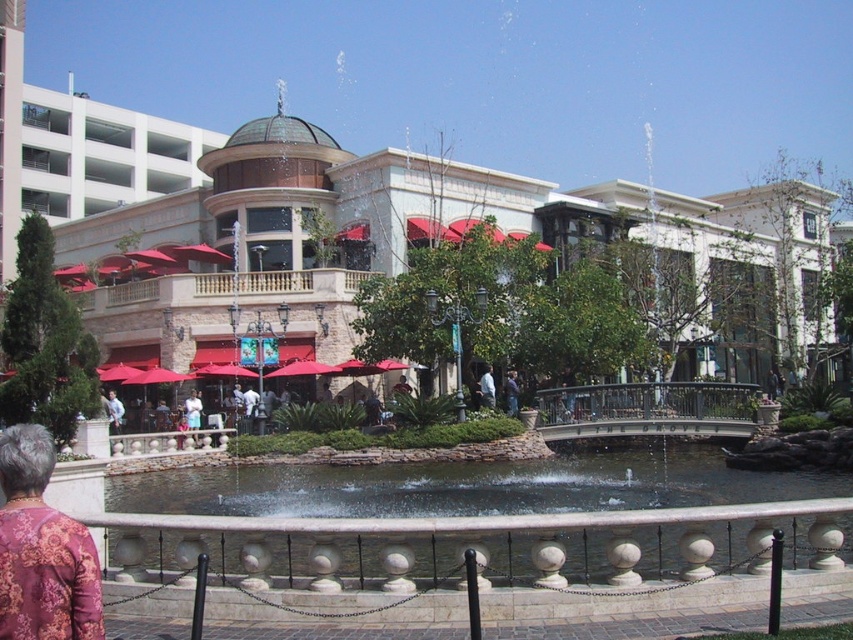
Question: Is patterned fabric jacket at lower left behind light blue fabric shirt at center?

Choices:
 (A) yes
 (B) no

Answer: (B)

Question: Which object is farther from the camera taking this photo?

Choices:
 (A) light blue fabric shirt at center
 (B) clear glass pond at center
 (C) white fabric person at center
 (D) patterned fabric jacket at lower left

Answer: (C)

Question: Which point is farther from the camera taking this photo?

Choices:
 (A) pyautogui.click(x=196, y=435)
 (B) pyautogui.click(x=274, y=563)
 (C) pyautogui.click(x=480, y=401)
 (D) pyautogui.click(x=509, y=380)

Answer: (D)

Question: Can you confirm if patterned fabric jacket at lower left is bigger than white fabric person at center?

Choices:
 (A) yes
 (B) no

Answer: (B)

Question: Considering the relative positions of clear glass pond at center and blue denim jeans at center in the image provided, where is clear glass pond at center located with respect to blue denim jeans at center?

Choices:
 (A) above
 (B) below

Answer: (B)

Question: Which object appears farthest from the camera in this image?

Choices:
 (A) white fabric person at center
 (B) clear glass pond at center

Answer: (A)